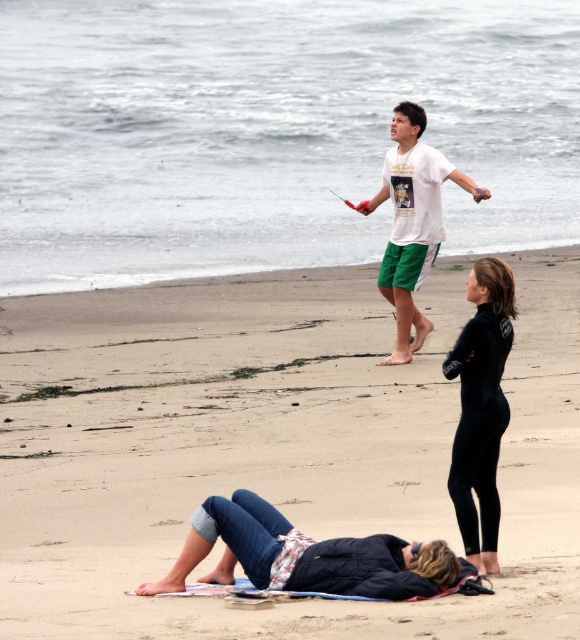
Question: Does smooth tan sand at center have a lesser width compared to denim pants at lower left?

Choices:
 (A) yes
 (B) no

Answer: (B)

Question: Can you confirm if smooth tan sand at center is bigger than black wetsuit at lower right?

Choices:
 (A) no
 (B) yes

Answer: (B)

Question: Which object is positioned closest to the smooth tan sand at center?

Choices:
 (A) white t-shirt at upper center
 (B) denim pants at lower left

Answer: (B)

Question: Is smooth tan sand at center in front of denim pants at lower left?

Choices:
 (A) no
 (B) yes

Answer: (B)

Question: Which of the following is the closest to the observer?

Choices:
 (A) (477, 344)
 (B) (90, 598)
 (C) (343, 592)
 (D) (435, 212)

Answer: (C)

Question: Which point is closer to the camera taking this photo?

Choices:
 (A) (490, 403)
 (B) (313, 483)
 (C) (436, 227)

Answer: (A)